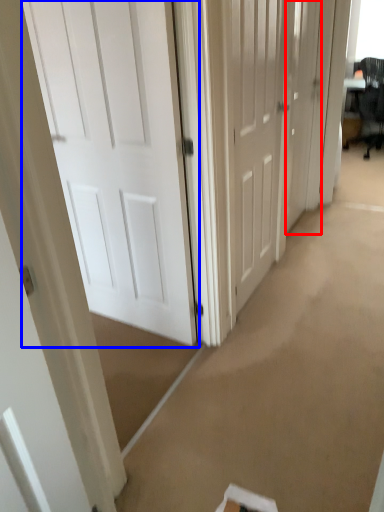
Question: Among these objects, which one is farthest to the camera, door (highlighted by a red box) or door (highlighted by a blue box)?

Choices:
 (A) door
 (B) door

Answer: (A)